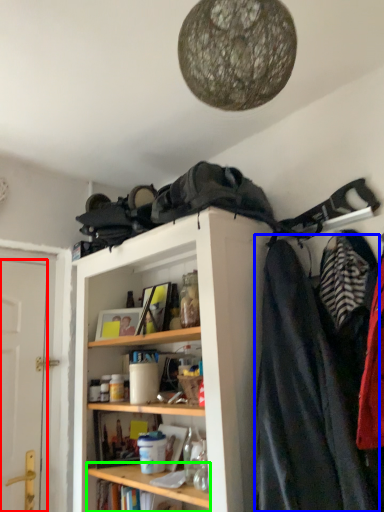
Question: Based on their relative distances, which object is nearer to door (highlighted by a red box)? Choose from cloak (highlighted by a blue box) and cabinet (highlighted by a green box).

Choices:
 (A) cloak
 (B) cabinet

Answer: (B)